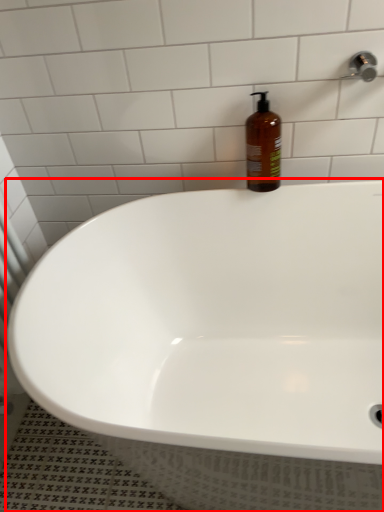
Question: Considering the relative positions of bathtub (annotated by the red box) and bottle in the image provided, where is bathtub (annotated by the red box) located with respect to the staircase?

Choices:
 (A) right
 (B) left

Answer: (B)